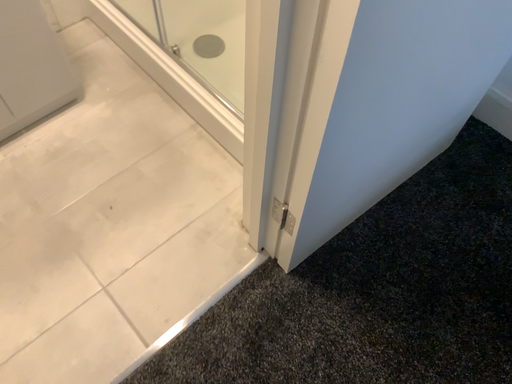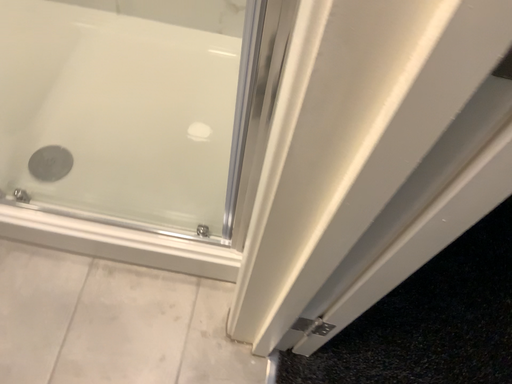
Question: Which way did the camera rotate in the video?

Choices:
 (A) rotated right
 (B) rotated left

Answer: (A)